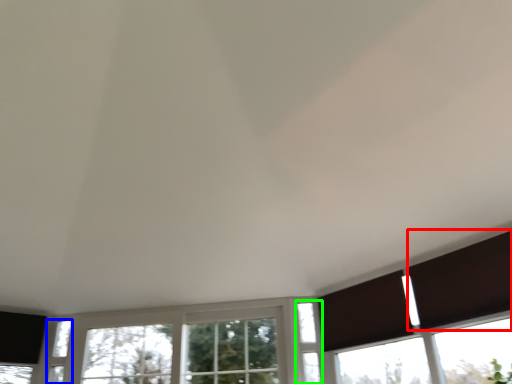
Question: Which is farther away from shutter (highlighted by a red box)? window (highlighted by a blue box) or window (highlighted by a green box)?

Choices:
 (A) window
 (B) window

Answer: (A)